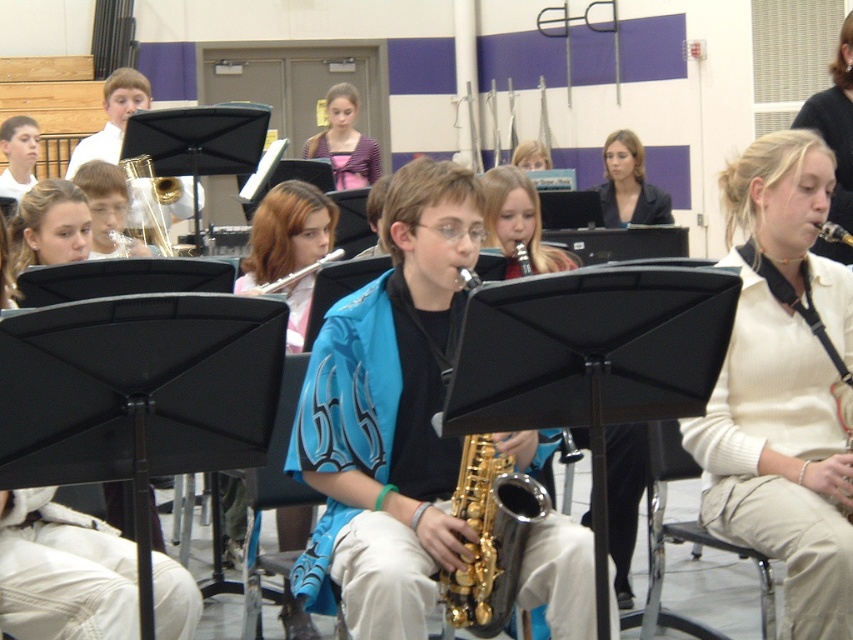
You are a photographer in the school band room. You want to capture a photo of the gold metallic saxophone at center without the blonde hair at upper right appearing in the frame. Is this possible based on their positions?

The blonde hair at upper right is positioned over the gold metallic saxophone at center, so it would block the view. To capture the saxophone without the hair, you would need to adjust the angle or move the saxophone lower.

You are a photographer setting up for a group photo in the band room. You need to position a light source above both the blue fabric shirt at center and the purple satin dress at center. Based on their positions, which object should the light be placed above to cover both?

The light should be placed above the purple satin dress at center because the blue fabric shirt at center is below it, so positioning the light above the higher object will cover both.

Based on the photo, you are a photographer setting up for a band photo shoot. You need to position a light source between the gold shiny saxophone at center and the matte black jacket at upper center. Considering their widths, which object should the light be closer to?

The gold shiny saxophone at center has a lesser width compared to the matte black jacket at upper center, so the light should be placed closer to the gold shiny saxophone at center to ensure even lighting between both objects.